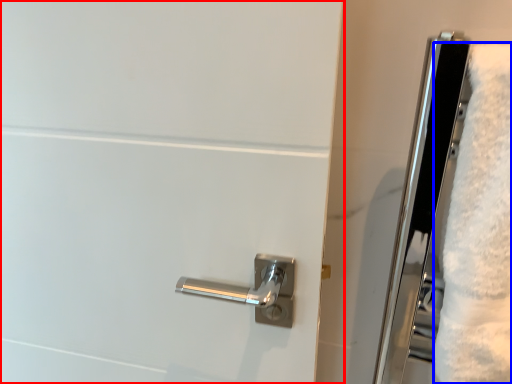
Question: Among these objects, which one is nearest to the camera, door (highlighted by a red box) or bath towel (highlighted by a blue box)?

Choices:
 (A) door
 (B) bath towel

Answer: (B)